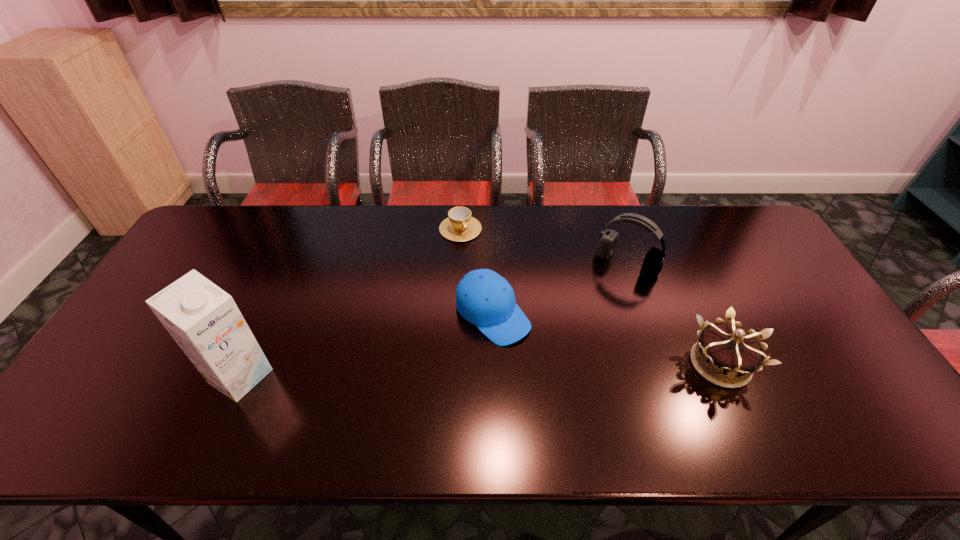
Locate an element on the screen. This screenshot has height=540, width=960. vacant space on the desktop that is between the carton and the crown and is positioned with the handle on the side of the cup is located at coordinates (539, 368).

This screenshot has width=960, height=540. I want to click on free space on the desktop that is between the carton and the crown and is positioned on the headband of the second farthest object, so click(x=549, y=368).

Locate an element on the screen. The image size is (960, 540). free space on the desktop that is between the tallest object and the third tallest object and is positioned on the front-facing side of the fourth tallest object is located at coordinates (551, 368).